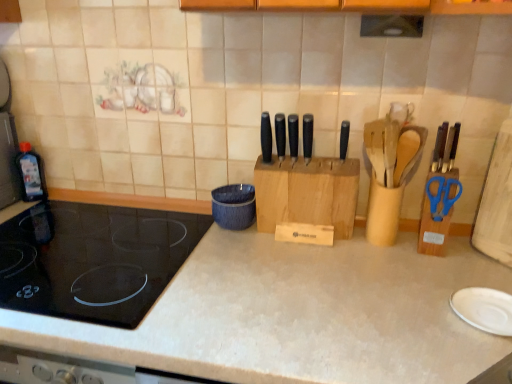
Locate an element on the screen. free space in front of wooden knife block at center is located at coordinates (317, 268).